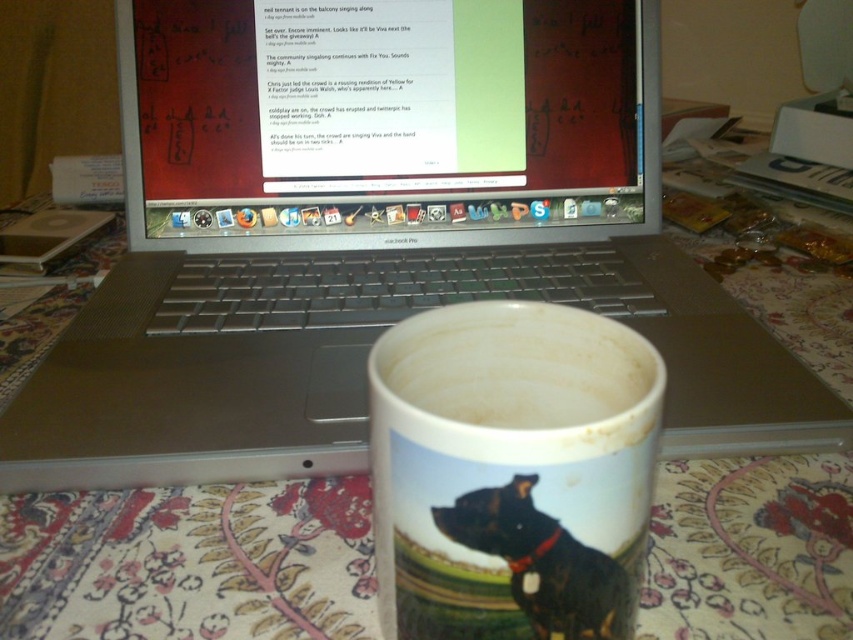
Who is positioned more to the right, matte plastic monitor at center or white glossy mug at center?

white glossy mug at center

Which is behind, point (264, 172) or point (397, 465)?

The point (264, 172) is more distant.

The width and height of the screenshot is (853, 640). In order to click on matte plastic monitor at center in this screenshot , I will do `click(387, 115)`.

Who is positioned more to the left, matte plastic monitor at center or black glossy dog at center?

Positioned to the left is matte plastic monitor at center.

Can you confirm if matte plastic monitor at center is bigger than black glossy dog at center?

Correct, matte plastic monitor at center is larger in size than black glossy dog at center.

Where is `matte plastic monitor at center`? Image resolution: width=853 pixels, height=640 pixels. matte plastic monitor at center is located at coordinates (387, 115).

The width and height of the screenshot is (853, 640). Identify the location of matte plastic monitor at center. (387, 115).

Is white glossy mug at center below black glossy dog at center?

No.

Between white glossy mug at center and black glossy dog at center, which one has less height?

black glossy dog at center

Is point (561, 484) closer to viewer compared to point (556, 621)?

Yes, point (561, 484) is closer to viewer.

Identify the location of white glossy mug at center. tap(509, 472).